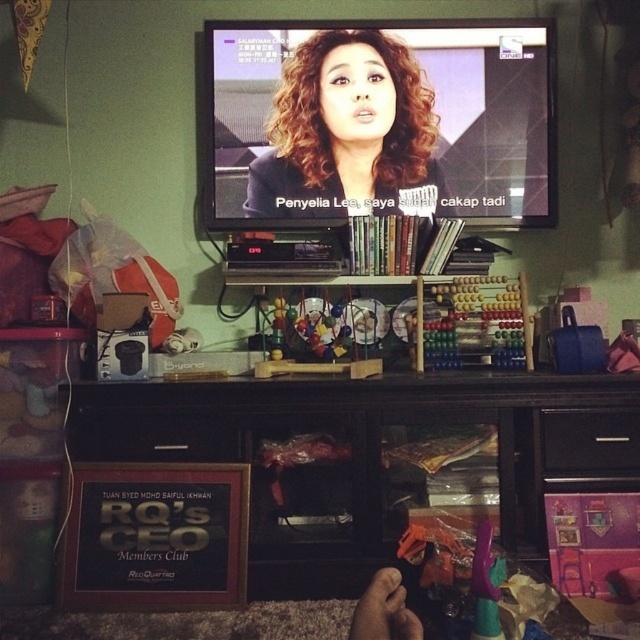
Question: Which of the following is the closest to the observer?

Choices:
 (A) black wood dresser at lower center
 (B) metallic plastic toy at center
 (C) wooden abacus at center
 (D) matte black hair at center

Answer: (A)

Question: Is black wood dresser at lower center above metallic plastic toy at center?

Choices:
 (A) yes
 (B) no

Answer: (B)

Question: Which of the following is the closest to the observer?

Choices:
 (A) wooden abacus at center
 (B) black wood dresser at lower center

Answer: (B)

Question: Can you confirm if black wood dresser at lower center is smaller than metallic plastic toy at center?

Choices:
 (A) yes
 (B) no

Answer: (B)

Question: Which point is farther to the camera?

Choices:
 (A) (336, 317)
 (B) (417, 102)
 (C) (424, 333)

Answer: (B)

Question: Is matte black hair at center to the left of metallic plastic toy at center from the viewer's perspective?

Choices:
 (A) yes
 (B) no

Answer: (B)